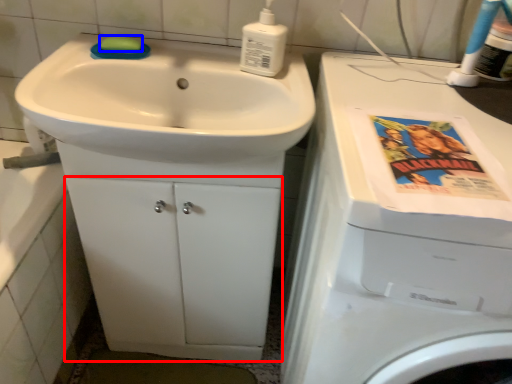
Question: Among these objects, which one is nearest to the camera, drawer (highlighted by a red box) or soap (highlighted by a blue box)?

Choices:
 (A) drawer
 (B) soap

Answer: (A)